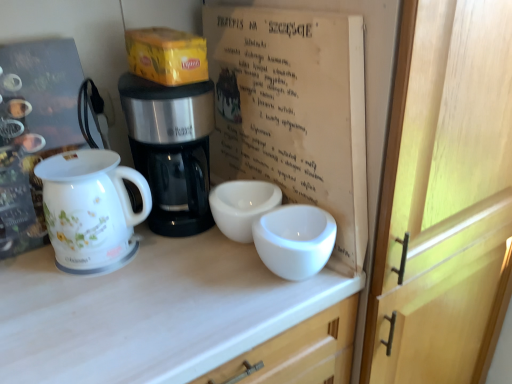
What do you see at coordinates (293, 111) in the screenshot?
I see `white paper at center` at bounding box center [293, 111].

In order to face yellow cardboard box at upper center, should I rotate leftwards or rightwards?

A 11.574 degree turn to the left will do.

Where is `white glossy jug at left`? This screenshot has width=512, height=384. white glossy jug at left is located at coordinates (91, 209).

Is yellow cardboard box at upper center inside or outside of black plastic coffee maker at center?

yellow cardboard box at upper center cannot be found inside black plastic coffee maker at center.

Can you tell me how much yellow cardboard box at upper center and black plastic coffee maker at center differ in facing direction?

yellow cardboard box at upper center and black plastic coffee maker at center are facing 7.56 degrees away from each other.

Looking at this image, considering the relative sizes of yellow cardboard box at upper center and black plastic coffee maker at center in the image provided, is yellow cardboard box at upper center thinner than black plastic coffee maker at center?

Yes, yellow cardboard box at upper center is thinner than black plastic coffee maker at center.

Is yellow cardboard box at upper center next to black plastic coffee maker at center?

yellow cardboard box at upper center and black plastic coffee maker at center are not in contact.

Which object is further away from the camera taking this photo, black plastic coffee maker at center or white glossy jug at left?

black plastic coffee maker at center.

At what (x,y) coordinates should I click in order to perform the action: click on jug in front of the black plastic coffee maker at center. Please return your answer as a coordinate pair (x, y). Image resolution: width=512 pixels, height=384 pixels. Looking at the image, I should click on (91, 209).

Which is more to the right, black plastic coffee maker at center or white glossy jug at left?

Positioned to the right is black plastic coffee maker at center.

The image size is (512, 384). What are the coordinates of `cardboard box to the right of white glossy jug at left` in the screenshot? It's located at (167, 56).

Can you confirm if yellow cardboard box at upper center is taller than white glossy jug at left?

No, yellow cardboard box at upper center is not taller than white glossy jug at left.

Considering the positions of objects yellow cardboard box at upper center and white glossy jug at left in the image provided, who is more to the right, yellow cardboard box at upper center or white glossy jug at left?

Positioned to the right is yellow cardboard box at upper center.

Is yellow cardboard box at upper center aimed at white glossy jug at left?

No.

Is white glossy jug at left in front of or behind black plastic coffee maker at center in the image?

white glossy jug at left is positioned closer to the viewer than black plastic coffee maker at center.

Does white glossy jug at left appear on the right side of black plastic coffee maker at center?

No, white glossy jug at left is not to the right of black plastic coffee maker at center.

Is white glossy jug at left thinner than black plastic coffee maker at center?

Indeed, white glossy jug at left has a lesser width compared to black plastic coffee maker at center.

Who is taller, white glossy jug at left or black plastic coffee maker at center?

black plastic coffee maker at center is taller.

Considering the relative positions of white paper at center and black plastic coffee maker at center in the image provided, is white paper at center to the right of black plastic coffee maker at center from the viewer's perspective?

Yes.

Can black plastic coffee maker at center be found inside white paper at center?

That's incorrect, black plastic coffee maker at center is not inside white paper at center.

From the image's perspective, is white paper at center located above or below black plastic coffee maker at center?

white paper at center is situated higher than black plastic coffee maker at center in the image.

Considering the positions of point (324, 174) and point (209, 83), is point (324, 174) closer or farther from the camera than point (209, 83)?

Clearly, point (324, 174) is closer to the camera than point (209, 83).

Based on the photo, how distant is white glossy jug at left from white paper at center?

34.29 centimeters.

Is white glossy jug at left next to white paper at center?

No, white glossy jug at left is not with white paper at center.

Which point is more forward, (102, 166) or (211, 139)?

Point (102, 166)

Does white glossy jug at left turn towards white paper at center?

No, white glossy jug at left is not aimed at white paper at center.

In the scene shown: Considering the positions of objects black plastic coffee maker at center and yellow cardboard box at upper center in the image provided, who is behind, black plastic coffee maker at center or yellow cardboard box at upper center?

yellow cardboard box at upper center is further away from the camera.

You are a GUI agent. You are given a task and a screenshot of the screen. Output one action in this format:
    pyautogui.click(x=<x>, y=<y>)
    Task: Click on the coffee maker directly beneath the yellow cardboard box at upper center (from a real-world perspective)
    
    Given the screenshot: What is the action you would take?
    pyautogui.click(x=170, y=150)

From the picture: Is black plastic coffee maker at center looking in the opposite direction of yellow cardboard box at upper center?

No, yellow cardboard box at upper center is not at the back of black plastic coffee maker at center.

Find the location of a particular element. The height and width of the screenshot is (384, 512). cardboard box on the left of black plastic coffee maker at center is located at coordinates (167, 56).

The height and width of the screenshot is (384, 512). Find the location of `coffee maker that appears above the white glossy jug at left (from a real-world perspective)`. coffee maker that appears above the white glossy jug at left (from a real-world perspective) is located at coordinates (170, 150).

Which object lies further to the anchor point yellow cardboard box at upper center, white paper at center or white glossy jug at left?

Based on the image, white glossy jug at left appears to be further to yellow cardboard box at upper center.

Looking at the image, which one is located closer to black plastic coffee maker at center, white glossy jug at left or white paper at center?

white glossy jug at left is positioned closer to the anchor black plastic coffee maker at center.

Considering their positions, is black plastic coffee maker at center positioned further to white glossy jug at left than white paper at center?

Among the two, white paper at center is located further to white glossy jug at left.

When comparing their distances from white glossy jug at left, does white paper at center or black plastic coffee maker at center seem further?

Among the two, white paper at center is located further to white glossy jug at left.

Based on their spatial positions, is white paper at center or yellow cardboard box at upper center further from white glossy jug at left?

The object further to white glossy jug at left is white paper at center.

Based on the photo, from the image, which object appears to be farther from white glossy jug at left, yellow cardboard box at upper center or black plastic coffee maker at center?

yellow cardboard box at upper center is further to white glossy jug at left.

From the image, which object appears to be farther from white paper at center, yellow cardboard box at upper center or black plastic coffee maker at center?

Based on the image, yellow cardboard box at upper center appears to be further to white paper at center.

Looking at the image, which one is located closer to white paper at center, white glossy jug at left or black plastic coffee maker at center?

black plastic coffee maker at center is positioned closer to the anchor white paper at center.

The image size is (512, 384). Find the location of `coffee maker between yellow cardboard box at upper center and white glossy jug at left from top to bottom`. coffee maker between yellow cardboard box at upper center and white glossy jug at left from top to bottom is located at coordinates (170, 150).

At what (x,y) coordinates should I click in order to perform the action: click on coffee maker between yellow cardboard box at upper center and white paper at center. Please return your answer as a coordinate pair (x, y). The width and height of the screenshot is (512, 384). Looking at the image, I should click on (170, 150).

Locate an element on the screen. The width and height of the screenshot is (512, 384). coffee maker between white glossy jug at left and white paper at center from left to right is located at coordinates (170, 150).

Locate an element on the screen. This screenshot has width=512, height=384. cardboard box situated between white glossy jug at left and white paper at center from left to right is located at coordinates (167, 56).